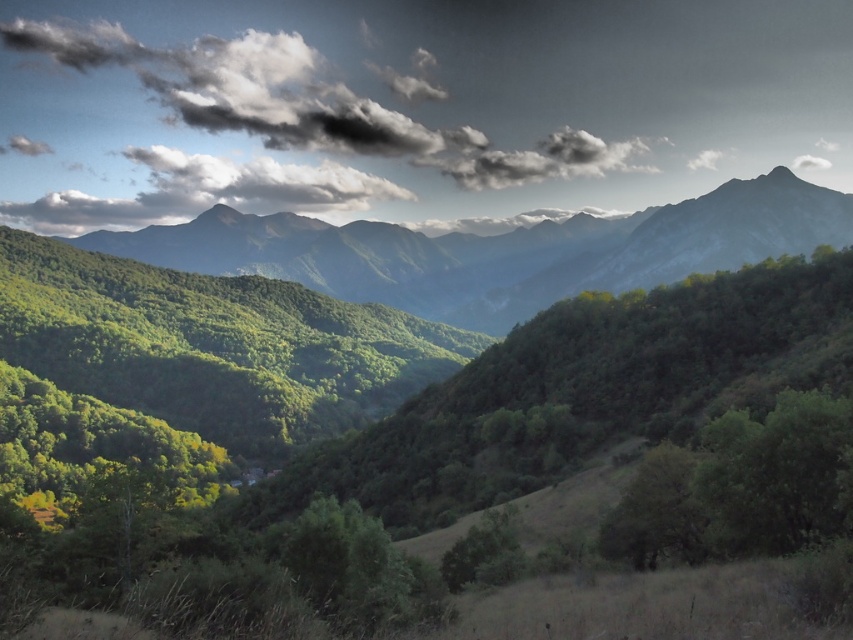
Is point (479, 291) positioned behind point (152, 168)?

That is False.

Is green matte mountain range at center above white fluffy cloud at upper center?

No.

Identify the location of green matte mountain range at center. Image resolution: width=853 pixels, height=640 pixels. (502, 250).

You are a GUI agent. You are given a task and a screenshot of the screen. Output one action in this format:
    pyautogui.click(x=<x>, y=<y>)
    Task: Click on the green matte mountain range at center
    
    Given the screenshot: What is the action you would take?
    pyautogui.click(x=502, y=250)

Which of these two, white fluffy cloud at upper center or green matte tree at lower center, stands taller?

white fluffy cloud at upper center is taller.

Which is above, white fluffy cloud at upper center or green matte tree at lower center?

white fluffy cloud at upper center

Is point (126, 208) in front of point (476, 531)?

No, it is behind (476, 531).

Identify the location of white fluffy cloud at upper center. The width and height of the screenshot is (853, 640). (202, 193).

Does green matte mountain range at center appear on the right side of green leafy tree at center?

Indeed, green matte mountain range at center is positioned on the right side of green leafy tree at center.

Is point (639, 282) farther from viewer compared to point (378, 602)?

Yes, point (639, 282) is behind point (378, 602).

Locate an element on the screen. green matte mountain range at center is located at coordinates 502,250.